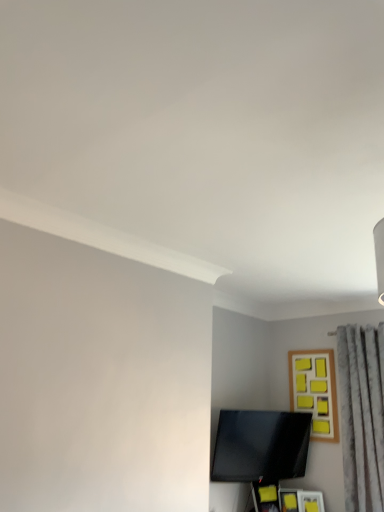
What do you see at coordinates (260, 446) in the screenshot? This screenshot has height=512, width=384. I see `black glossy tv at lower center` at bounding box center [260, 446].

I want to click on gray textured curtain at right, so click(362, 415).

What do you see at coordinates (362, 415) in the screenshot?
I see `gray textured curtain at right` at bounding box center [362, 415].

In order to face wooden frame with yellow sticky notes at upper right, should I rotate leftwards or rightwards?

Turn right approximately 15.573 degrees to face it.

What do you see at coordinates (315, 391) in the screenshot? The height and width of the screenshot is (512, 384). I see `wooden frame with yellow sticky notes at upper right` at bounding box center [315, 391].

You are a GUI agent. You are given a task and a screenshot of the screen. Output one action in this format:
    pyautogui.click(x=<x>, y=<y>)
    Task: Click on the black glossy tv at lower center
    The height and width of the screenshot is (512, 384).
    Given the screenshot: What is the action you would take?
    pyautogui.click(x=260, y=446)

Which of these two, black glossy tv at lower center or gray textured curtain at right, stands taller?

Standing taller between the two is gray textured curtain at right.

Looking at their sizes, would you say black glossy tv at lower center is wider or thinner than gray textured curtain at right?

Considering their sizes, black glossy tv at lower center looks slimmer than gray textured curtain at right.

Relative to gray textured curtain at right, is black glossy tv at lower center in front or behind?

Clearly, black glossy tv at lower center is behind gray textured curtain at right.

Is wooden frame with yellow sticky notes at upper right in front of or behind black glossy tv at lower center in the image?

wooden frame with yellow sticky notes at upper right is behind black glossy tv at lower center.

At what (x,y) coordinates should I click in order to perform the action: click on television below the wooden frame with yellow sticky notes at upper right (from the image's perspective). Please return your answer as a coordinate pair (x, y). This screenshot has width=384, height=512. Looking at the image, I should click on (260, 446).

Is wooden frame with yellow sticky notes at upper right positioned far away from black glossy tv at lower center?

No.

From a real-world perspective, who is located higher, wooden frame with yellow sticky notes at upper right or black glossy tv at lower center?

From a 3D spatial view, wooden frame with yellow sticky notes at upper right is above.

Is gray textured curtain at right positioned beyond the bounds of black glossy tv at lower center?

Indeed, gray textured curtain at right is completely outside black glossy tv at lower center.

Which of these two, gray textured curtain at right or black glossy tv at lower center, is bigger?

gray textured curtain at right.

Considering their positions, is gray textured curtain at right located in front of or behind black glossy tv at lower center?

gray textured curtain at right is positioned closer to the viewer than black glossy tv at lower center.

From the picture: Can you tell me how much gray textured curtain at right and black glossy tv at lower center differ in facing direction?

The facing directions of gray textured curtain at right and black glossy tv at lower center are 71.9 degrees apart.

Would you say wooden frame with yellow sticky notes at upper right is inside or outside gray textured curtain at right?

wooden frame with yellow sticky notes at upper right cannot be found inside gray textured curtain at right.

From the image's perspective, between wooden frame with yellow sticky notes at upper right and gray textured curtain at right, which one is located above?

wooden frame with yellow sticky notes at upper right.

Measure the distance from wooden frame with yellow sticky notes at upper right to gray textured curtain at right.

The distance of wooden frame with yellow sticky notes at upper right from gray textured curtain at right is 29.43 centimeters.

Is wooden frame with yellow sticky notes at upper right facing away from gray textured curtain at right?

No, wooden frame with yellow sticky notes at upper right's orientation is not away from gray textured curtain at right.

Can you confirm if gray textured curtain at right is wider than wooden frame with yellow sticky notes at upper right?

Indeed, gray textured curtain at right has a greater width compared to wooden frame with yellow sticky notes at upper right.

From a real-world perspective, which object stands above the other?

wooden frame with yellow sticky notes at upper right, from a real-world perspective.

Do you think gray textured curtain at right is within wooden frame with yellow sticky notes at upper right, or outside of it?

gray textured curtain at right is outside wooden frame with yellow sticky notes at upper right.

Does gray textured curtain at right have a greater height compared to wooden frame with yellow sticky notes at upper right?

Yes, gray textured curtain at right is taller than wooden frame with yellow sticky notes at upper right.

From a real-world perspective, which object rests below the other?

In real-world perspective, black glossy tv at lower center is lower.

Would you consider black glossy tv at lower center to be distant from wooden frame with yellow sticky notes at upper right?

Actually, black glossy tv at lower center and wooden frame with yellow sticky notes at upper right are a little close together.

Locate an element on the screen. Image resolution: width=384 pixels, height=512 pixels. picture frame on the right of black glossy tv at lower center is located at coordinates (315, 391).

Looking at this image, can you tell me how much black glossy tv at lower center and wooden frame with yellow sticky notes at upper right differ in facing direction?

They differ by 72.6 degrees in their facing directions.

The image size is (384, 512). I want to click on television on the left of gray textured curtain at right, so click(x=260, y=446).

This screenshot has width=384, height=512. Find the location of `television in front of the wooden frame with yellow sticky notes at upper right`. television in front of the wooden frame with yellow sticky notes at upper right is located at coordinates (260, 446).

When comparing their distances from gray textured curtain at right, does black glossy tv at lower center or wooden frame with yellow sticky notes at upper right seem further?

The object further to gray textured curtain at right is black glossy tv at lower center.

When comparing their distances from black glossy tv at lower center, does wooden frame with yellow sticky notes at upper right or gray textured curtain at right seem closer?

Based on the image, wooden frame with yellow sticky notes at upper right appears to be nearer to black glossy tv at lower center.

Considering their positions, is black glossy tv at lower center positioned closer to wooden frame with yellow sticky notes at upper right than gray textured curtain at right?

Based on the image, gray textured curtain at right appears to be nearer to wooden frame with yellow sticky notes at upper right.

When comparing their distances from wooden frame with yellow sticky notes at upper right, does gray textured curtain at right or black glossy tv at lower center seem closer?

The object closer to wooden frame with yellow sticky notes at upper right is gray textured curtain at right.

Estimate the real-world distances between objects in this image. Which object is closer to black glossy tv at lower center, gray textured curtain at right or wooden frame with yellow sticky notes at upper right?

wooden frame with yellow sticky notes at upper right is closer to black glossy tv at lower center.

Estimate the real-world distances between objects in this image. Which object is closer to gray textured curtain at right, wooden frame with yellow sticky notes at upper right or black glossy tv at lower center?

The object closer to gray textured curtain at right is wooden frame with yellow sticky notes at upper right.

Identify the location of picture frame located between black glossy tv at lower center and gray textured curtain at right in the left-right direction. (315, 391).